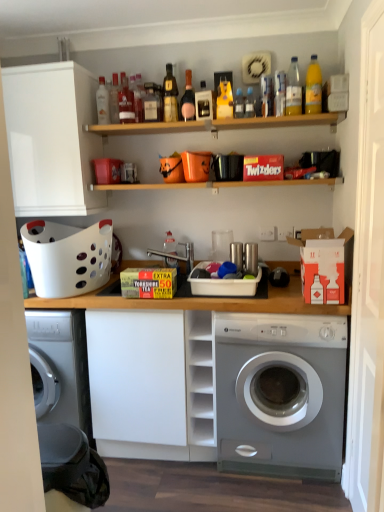
Question: Is translucent plastic bottle at upper center, the 3th bottle viewed from the right, behind translucent glass bottle at upper center, which ranks as the sixth bottle in right-to-left order?

Choices:
 (A) no
 (B) yes

Answer: (A)

Question: From the image's perspective, is translucent plastic bottle at upper center, placed as the eighth bottle when sorted from left to right, below translucent glass bottle at upper center, which ranks as the sixth bottle in right-to-left order?

Choices:
 (A) no
 (B) yes

Answer: (B)

Question: Would you consider translucent plastic bottle at upper center, placed as the eighth bottle when sorted from left to right, to be distant from translucent glass bottle at upper center, which ranks as the sixth bottle in right-to-left order?

Choices:
 (A) no
 (B) yes

Answer: (A)

Question: From a real-world perspective, is translucent plastic bottle at upper center, the 3th bottle viewed from the right, physically below translucent glass bottle at upper center, acting as the fifth bottle starting from the left?

Choices:
 (A) yes
 (B) no

Answer: (A)

Question: Does translucent plastic bottle at upper center, the 3th bottle viewed from the right, appear on the left side of translucent glass bottle at upper center, acting as the fifth bottle starting from the left?

Choices:
 (A) no
 (B) yes

Answer: (A)

Question: Looking at the image, does white matte cabinet at upper left seem bigger or smaller compared to matte glass bottle at upper center, which is the 1th bottle from left to right?

Choices:
 (A) small
 (B) big

Answer: (B)

Question: Is point (43, 190) positioned closer to the camera than point (127, 106)?

Choices:
 (A) farther
 (B) closer

Answer: (B)

Question: Is white matte cabinet at upper left in front of or behind matte glass bottle at upper center, which appears as the tenth bottle when viewed from the right, in the image?

Choices:
 (A) front
 (B) behind

Answer: (A)

Question: Considering the positions of white matte cabinet at upper left and matte glass bottle at upper center, which appears as the tenth bottle when viewed from the right, in the image, is white matte cabinet at upper left taller or shorter than matte glass bottle at upper center, which appears as the tenth bottle when viewed from the right,?

Choices:
 (A) short
 (B) tall

Answer: (B)

Question: From the image's perspective, relative to translucent plastic bottle at upper center, arranged as the ninth bottle when viewed from the left, is matte glass bottle at center, placed as the third bottle when sorted from left to right, above or below?

Choices:
 (A) below
 (B) above

Answer: (A)

Question: Considering the positions of matte glass bottle at center, acting as the 8th bottle starting from the right, and translucent plastic bottle at upper center, positioned as the 2th bottle in right-to-left order, in the image, is matte glass bottle at center, acting as the 8th bottle starting from the right, wider or thinner than translucent plastic bottle at upper center, positioned as the 2th bottle in right-to-left order,?

Choices:
 (A) wide
 (B) thin

Answer: (A)

Question: Considering the positions of point (157, 106) and point (288, 93), is point (157, 106) closer or farther from the camera than point (288, 93)?

Choices:
 (A) farther
 (B) closer

Answer: (A)

Question: Would you say matte glass bottle at center, acting as the 8th bottle starting from the right, is to the left or to the right of translucent plastic bottle at upper center, arranged as the ninth bottle when viewed from the left, in the picture?

Choices:
 (A) right
 (B) left

Answer: (B)

Question: From a real-world perspective, is wooden shelf at upper center physically located above or below matte glass bottle at upper center, the sixth bottle viewed from the left?

Choices:
 (A) below
 (B) above

Answer: (A)

Question: Is point (304, 121) positioned closer to the camera than point (182, 102)?

Choices:
 (A) closer
 (B) farther

Answer: (A)